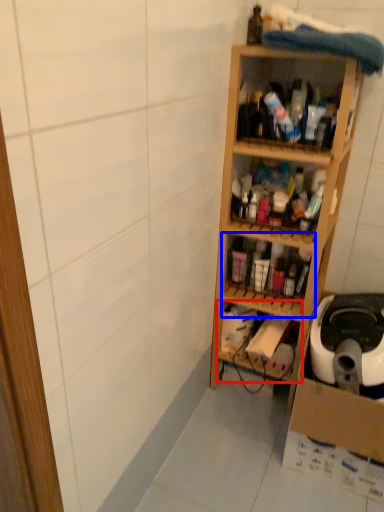
Question: Which of the following is the closest to the observer, shelf (highlighted by a red box) or shelf (highlighted by a blue box)?

Choices:
 (A) shelf
 (B) shelf

Answer: (A)